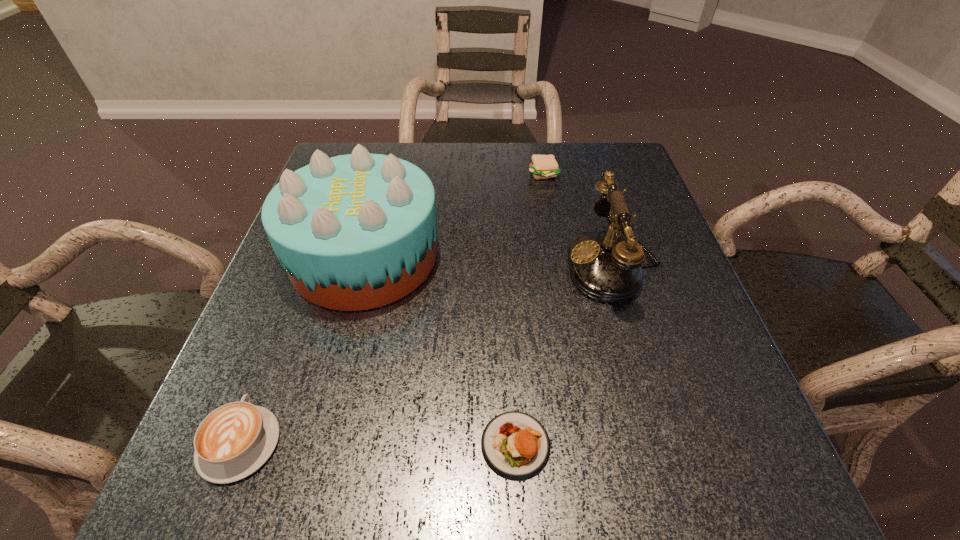
Where is `cappuccino that is at the left edge`? This screenshot has height=540, width=960. cappuccino that is at the left edge is located at coordinates (233, 441).

The width and height of the screenshot is (960, 540). Find the location of `object present at the right edge`. object present at the right edge is located at coordinates (605, 266).

Where is `object that is positioned at the near left corner`? This screenshot has height=540, width=960. object that is positioned at the near left corner is located at coordinates click(233, 441).

At what (x,y) coordinates should I click in order to perform the action: click on vacant space at the far edge of the desktop. Please return your answer as a coordinate pair (x, y). The image size is (960, 540). Looking at the image, I should click on (489, 143).

Locate an element on the screen. This screenshot has height=540, width=960. vacant space at the left edge of the desktop is located at coordinates (262, 325).

Where is `vacant space at the right edge of the desktop`? vacant space at the right edge of the desktop is located at coordinates (619, 305).

This screenshot has height=540, width=960. In the image, there is a desktop. In order to click on vacant space at the near left corner in this screenshot , I will do `click(189, 463)`.

Locate an element on the screen. The width and height of the screenshot is (960, 540). free spot at the far right corner of the desktop is located at coordinates (624, 147).

The height and width of the screenshot is (540, 960). Find the location of `free space between the cappuccino and the right patty (food)`. free space between the cappuccino and the right patty (food) is located at coordinates coord(392,308).

Locate an element on the screen. The height and width of the screenshot is (540, 960). free spot between the farther patty (food) and the second tallest object is located at coordinates (578, 219).